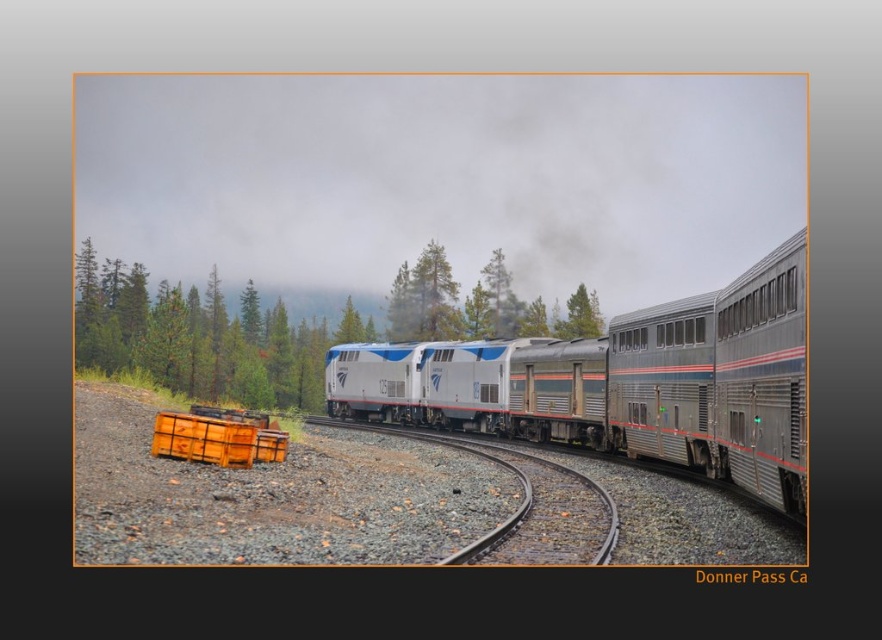
Question: Does silver metallic train at center appear under metal/smooth train track at center?

Choices:
 (A) yes
 (B) no

Answer: (B)

Question: Considering the relative positions of green leafy tree at center and metal/smooth train track at center in the image provided, where is green leafy tree at center located with respect to metal/smooth train track at center?

Choices:
 (A) above
 (B) below

Answer: (A)

Question: Which of the following is the closest to the observer?

Choices:
 (A) silver metallic train at center
 (B) green leafy tree at center
 (C) metal/smooth train track at center

Answer: (A)

Question: Estimate the real-world distances between objects in this image. Which object is closer to the green leafy tree at center?

Choices:
 (A) silver metallic train at center
 (B) metal/smooth train track at center

Answer: (A)

Question: Can you confirm if green leafy tree at center is wider than metal/smooth train track at center?

Choices:
 (A) yes
 (B) no

Answer: (A)

Question: Which of these objects is positioned closest to the silver metallic train at center?

Choices:
 (A) metal/smooth train track at center
 (B) green leafy tree at center

Answer: (A)